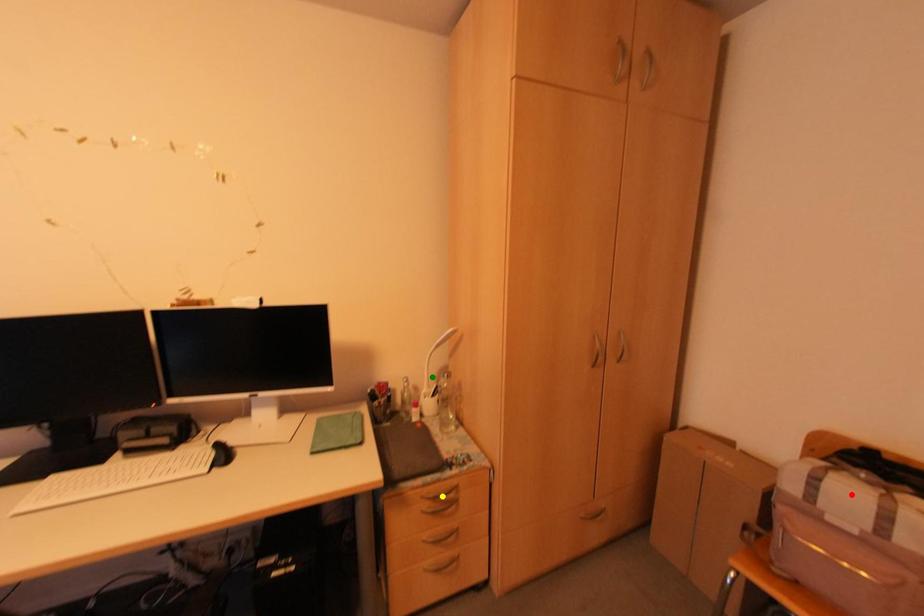
Order these from nearest to farthest:
red point, yellow point, green point

1. red point
2. yellow point
3. green point